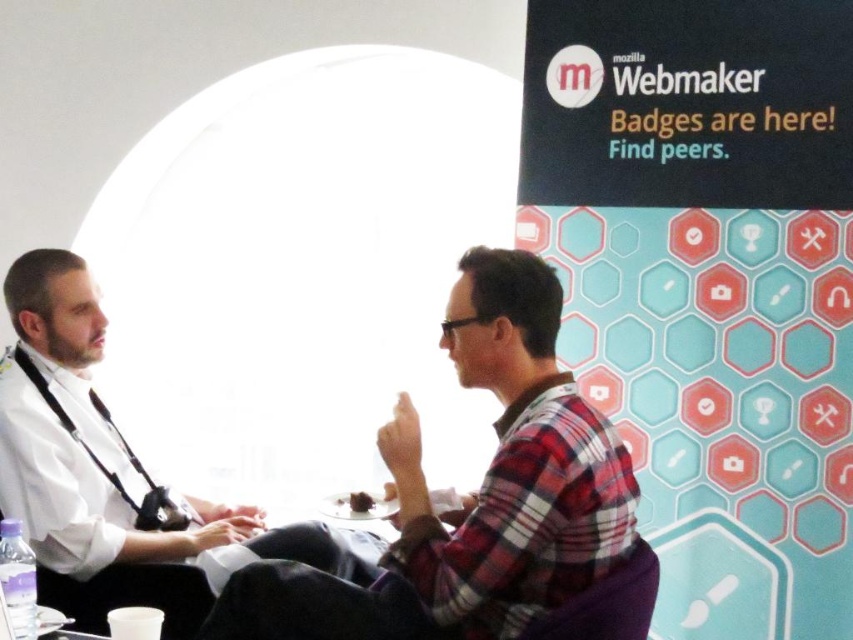
At what (x,y) coordinates should I click in order to perform the action: click on plaid fabric shirt at center. Please return your answer as a coordinate pair (x, y). Image resolution: width=853 pixels, height=640 pixels. Looking at the image, I should click on (471, 493).

Is plaid fabric shirt at center below white matte shirt at left?

Indeed, plaid fabric shirt at center is positioned under white matte shirt at left.

Is point (604, 460) more distant than point (73, 493)?

No.

Identify the location of plaid fabric shirt at center. The image size is (853, 640). pyautogui.click(x=471, y=493).